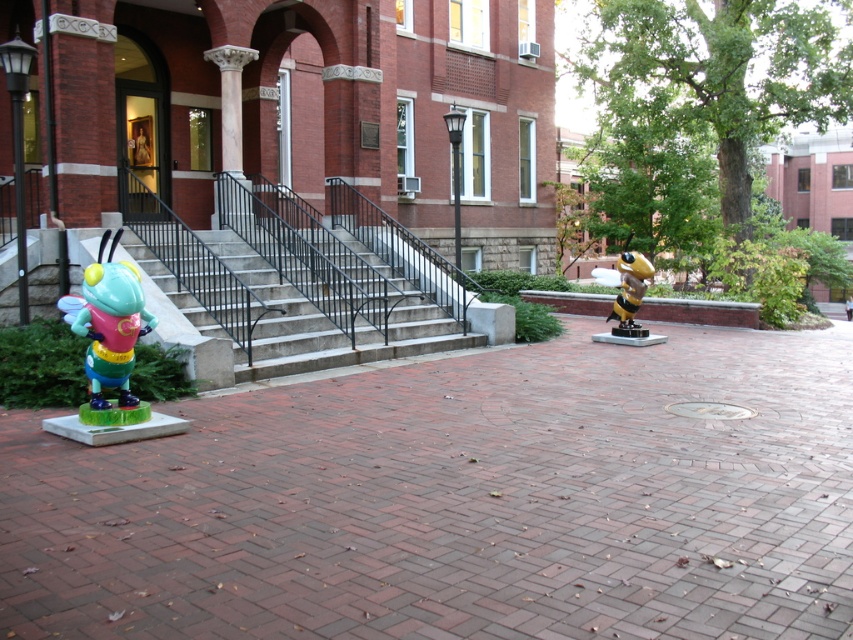
Question: Does concrete stairs at center have a lesser width compared to yellow and black plastic bee at center right?

Choices:
 (A) yes
 (B) no

Answer: (B)

Question: Which object is positioned farthest from the yellow and black plastic bee at center right?

Choices:
 (A) matte plastic bee at left
 (B) brick pavement at center

Answer: (A)

Question: Is brick pavement at center positioned at the back of yellow and black plastic bee at center right?

Choices:
 (A) no
 (B) yes

Answer: (A)

Question: Can you confirm if concrete stairs at center is bigger than yellow and black plastic bee at center right?

Choices:
 (A) yes
 (B) no

Answer: (B)

Question: Which object is positioned closest to the yellow and black plastic bee at center right?

Choices:
 (A) concrete stairs at center
 (B) matte plastic bee at left

Answer: (A)

Question: Considering the real-world distances, which object is farthest from the concrete stairs at center?

Choices:
 (A) brick pavement at center
 (B) yellow and black plastic bee at center right

Answer: (B)